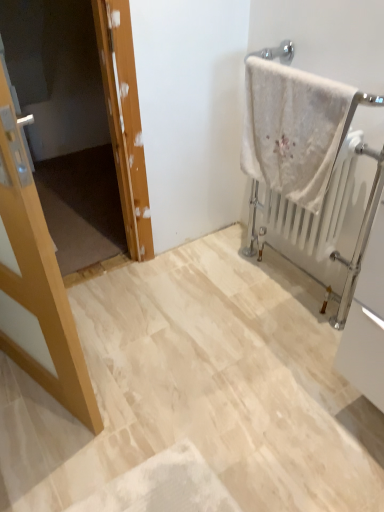
Locate an element on the screen. The image size is (384, 512). vacant space underneath light wood door at left (from a real-world perspective) is located at coordinates (35, 388).